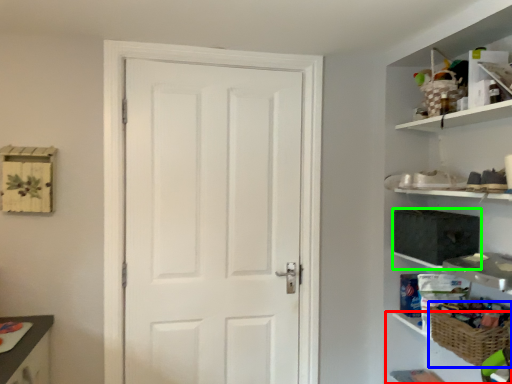
Question: Which object is positioned farthest from cabinet (highlighted by a red box)? Select from basket (highlighted by a blue box) and medicine cabinet (highlighted by a green box).

Choices:
 (A) basket
 (B) medicine cabinet

Answer: (B)